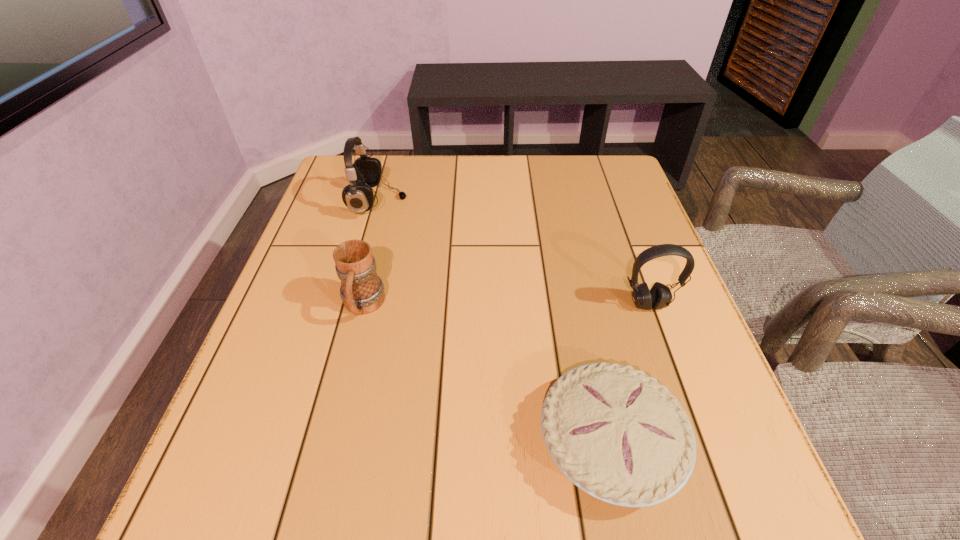
Locate an element on the screen. The image size is (960, 540). the farthest object is located at coordinates (365, 173).

At what (x,y) coordinates should I click in order to perform the action: click on the farther headset. Please return your answer as a coordinate pair (x, y). The height and width of the screenshot is (540, 960). Looking at the image, I should click on (365, 173).

You are a GUI agent. You are given a task and a screenshot of the screen. Output one action in this format:
    pyautogui.click(x=<x>, y=<y>)
    Task: Click on the right headset
    
    Given the screenshot: What is the action you would take?
    pyautogui.click(x=659, y=296)

Identify the location of mug. This screenshot has width=960, height=540. (362, 291).

You are a GUI agent. You are given a task and a screenshot of the screen. Output one action in this format:
    pyautogui.click(x=<x>, y=<y>)
    Task: Click on the nearest object
    
    Given the screenshot: What is the action you would take?
    pyautogui.click(x=616, y=433)

Where is `the shortest object`? This screenshot has height=540, width=960. the shortest object is located at coordinates (616, 433).

I want to click on free spot located 0.390m with the microphone on the side of the farther headset, so click(554, 202).

Locate an element on the screen. Image resolution: width=960 pixels, height=540 pixels. vacant area located on the front-facing side of the right headset is located at coordinates (696, 436).

The width and height of the screenshot is (960, 540). In order to click on vacant position located on the side of the third tallest object with the handle in this screenshot , I will do `click(324, 463)`.

Identify the location of free space located on the back of the pie. The height and width of the screenshot is (540, 960). (580, 300).